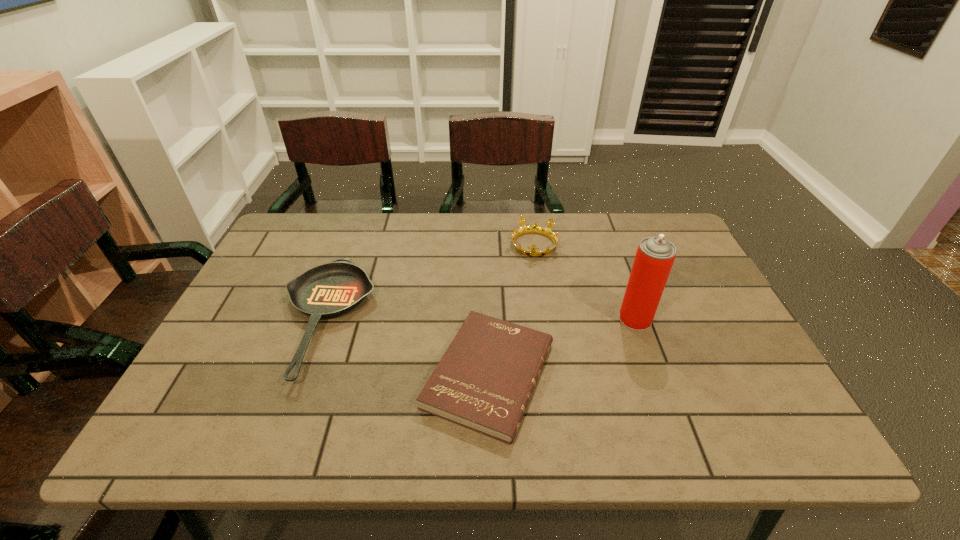
Locate an element on the screen. the rightmost object is located at coordinates (654, 258).

What are the coordinates of `the tallest object` in the screenshot? It's located at (654, 258).

The height and width of the screenshot is (540, 960). Find the location of `crown`. crown is located at coordinates (535, 228).

Identify the location of the farthest object. (535, 228).

Find the location of `frying pan`. frying pan is located at coordinates (329, 290).

Identify the location of hardback book. The image size is (960, 540). (484, 381).

Where is `free spot located on the left of the rightmost object`? Image resolution: width=960 pixels, height=540 pixels. free spot located on the left of the rightmost object is located at coordinates (526, 319).

The image size is (960, 540). In order to click on vacant area situated 0.110m on the front of the crown in this screenshot , I will do `click(540, 286)`.

Identify the location of vacant space located 0.180m on the back of the frying pan. (356, 231).

Locate an element on the screen. This screenshot has height=540, width=960. vacant space situated 0.220m on the back of the hardback book is located at coordinates click(487, 266).